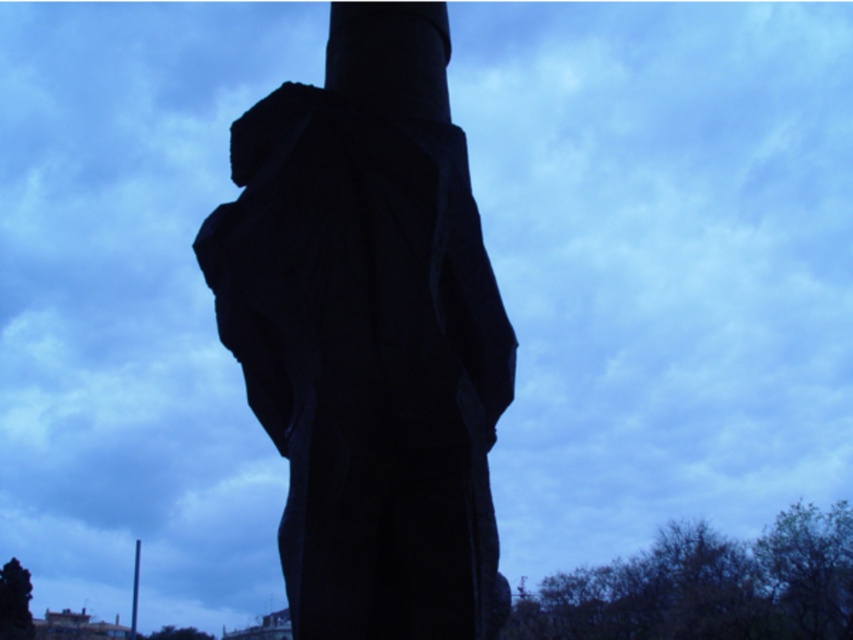
Question: Can you confirm if dark green tree at lower left is positioned above smooth black pole at lower left?

Choices:
 (A) yes
 (B) no

Answer: (B)

Question: Which object appears farthest from the camera in this image?

Choices:
 (A) dark green tree at lower left
 (B) black stone statue at center
 (C) smooth black pole at lower left

Answer: (C)

Question: Is black stone statue at center further to camera compared to smooth black pole at lower left?

Choices:
 (A) no
 (B) yes

Answer: (A)

Question: Does dark green tree at lower left have a larger size compared to smooth black pole at lower left?

Choices:
 (A) yes
 (B) no

Answer: (B)

Question: Which of the following is the closest to the observer?

Choices:
 (A) smooth black pole at lower left
 (B) dark green tree at lower left
 (C) black stone statue at center

Answer: (C)

Question: Which object appears farthest from the camera in this image?

Choices:
 (A) black stone statue at center
 (B) smooth black pole at lower left

Answer: (B)